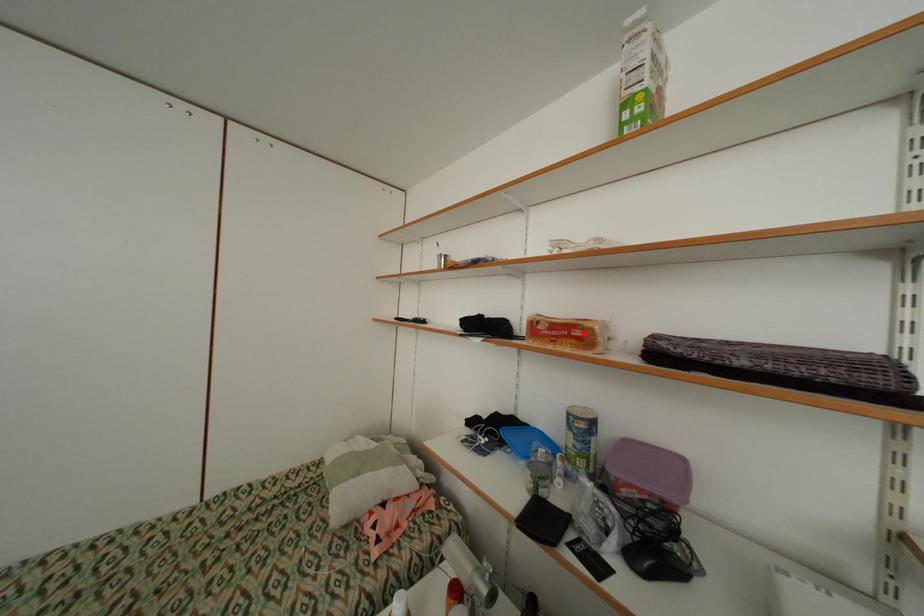
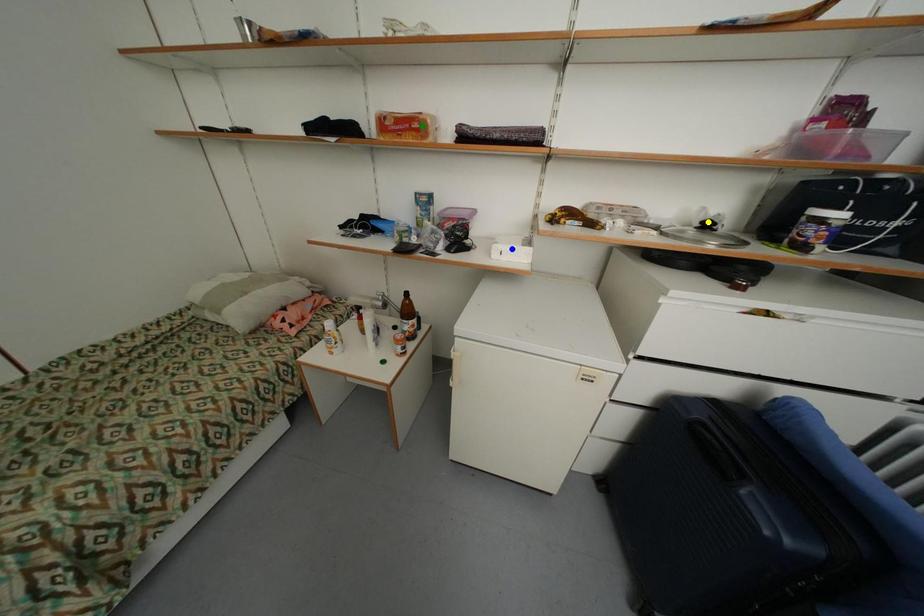
Question: I am providing you with two images of the same scene from different viewpoints. A red point is marked on the first image. You are given multiple points on the second image. In image 2, which mark is for the same physical point as the one in image 1?

Choices:
 (A) green point
 (B) blue point
 (C) yellow point

Answer: (A)